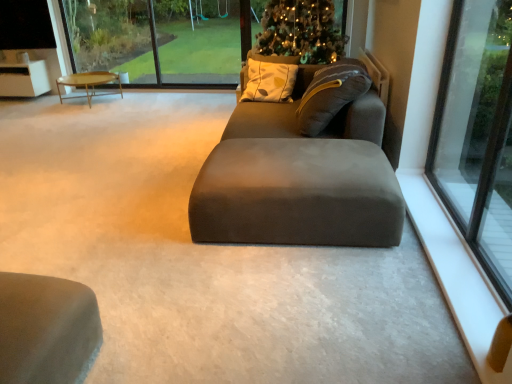
This screenshot has height=384, width=512. Find the location of `vacant space to the left of suede gray bean bag at center`. vacant space to the left of suede gray bean bag at center is located at coordinates (148, 160).